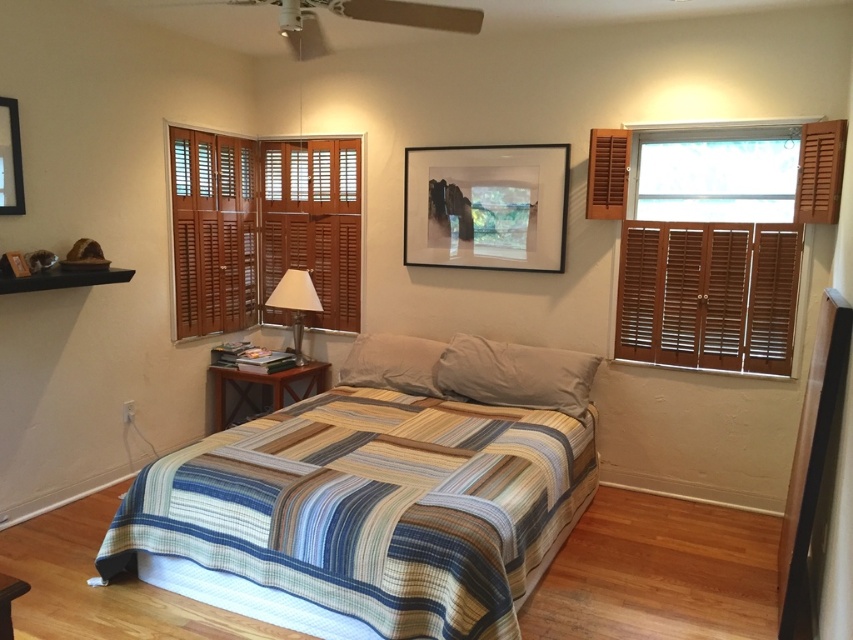
Which is more to the left, black matte picture frame at upper center or matte black picture frame at upper left?

matte black picture frame at upper left

This screenshot has height=640, width=853. Describe the element at coordinates (486, 205) in the screenshot. I see `black matte picture frame at upper center` at that location.

Does point (554, 150) come farther from viewer compared to point (21, 182)?

Yes, point (554, 150) is behind point (21, 182).

At what (x,y) coordinates should I click in order to perform the action: click on black matte picture frame at upper center. Please return your answer as a coordinate pair (x, y). This screenshot has width=853, height=640. Looking at the image, I should click on (486, 205).

Is point (418, 378) farther from camera compared to point (297, 372)?

No, it is not.

Locate an element on the screen. The image size is (853, 640). white matte pillow at center is located at coordinates [x=392, y=364].

Image resolution: width=853 pixels, height=640 pixels. What are the coordinates of `white matte pillow at center` in the screenshot? It's located at (392, 364).

Is striped quilted bed at center to the right of white fabric lampshade at left from the viewer's perspective?

Correct, you'll find striped quilted bed at center to the right of white fabric lampshade at left.

Between point (489, 490) and point (299, 364), which one is positioned in front?

Positioned in front is point (489, 490).

The image size is (853, 640). I want to click on striped quilted bed at center, so click(x=372, y=508).